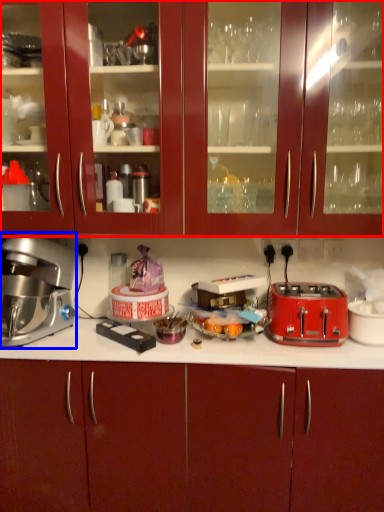
Question: Which object is closer to the camera taking this photo, cabinetry (highlighted by a red box) or home appliance (highlighted by a blue box)?

Choices:
 (A) cabinetry
 (B) home appliance

Answer: (A)